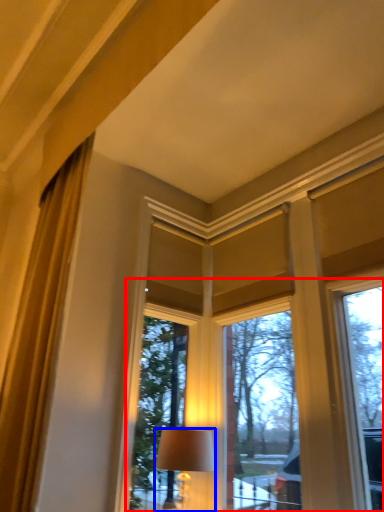
Question: Among these objects, which one is farthest to the camera, bay window (highlighted by a red box) or lamp (highlighted by a blue box)?

Choices:
 (A) bay window
 (B) lamp

Answer: (B)